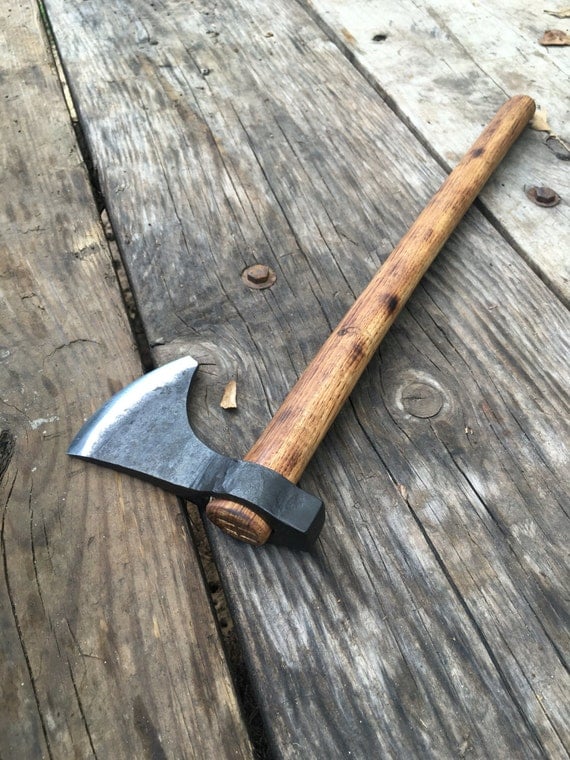
At what (x,y) coordinates should I click in order to perform the action: click on middle plank. Please return your answer as a coordinate pair (x, y). The image size is (570, 760). Looking at the image, I should click on (210, 192).